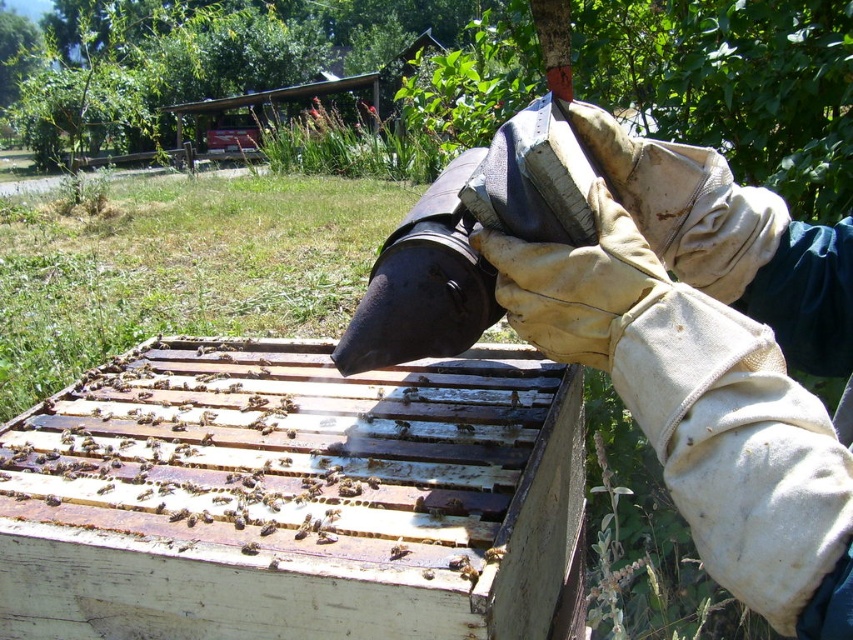
Is translucent brown honeycomb at center wider than translucent plastic bee at center?

Yes, translucent brown honeycomb at center is wider than translucent plastic bee at center.

Does point (459, 429) lie behind point (512, 394)?

No, it is not.

This screenshot has width=853, height=640. Identify the location of translucent brown honeycomb at center. (465, 428).

Describe the element at coordinates (293, 497) in the screenshot. This screenshot has height=640, width=853. I see `wooden beehive at center` at that location.

Can you confirm if wooden beehive at center is smaller than translucent plastic bee at center?

Incorrect, wooden beehive at center is not smaller in size than translucent plastic bee at center.

Image resolution: width=853 pixels, height=640 pixels. What do you see at coordinates (293, 497) in the screenshot?
I see `wooden beehive at center` at bounding box center [293, 497].

Where is `wooden beehive at center`? The image size is (853, 640). wooden beehive at center is located at coordinates (293, 497).

In the scene shown: Is white cotton gloves at upper right to the right of translucent plastic bee at center from the viewer's perspective?

Correct, you'll find white cotton gloves at upper right to the right of translucent plastic bee at center.

Between white cotton gloves at upper right and translucent plastic bee at center, which one has more height?

Standing taller between the two is white cotton gloves at upper right.

Does point (772, 458) come in front of point (509, 400)?

Yes, it is.

Where is `white cotton gloves at upper right`? The height and width of the screenshot is (640, 853). white cotton gloves at upper right is located at coordinates (712, 358).